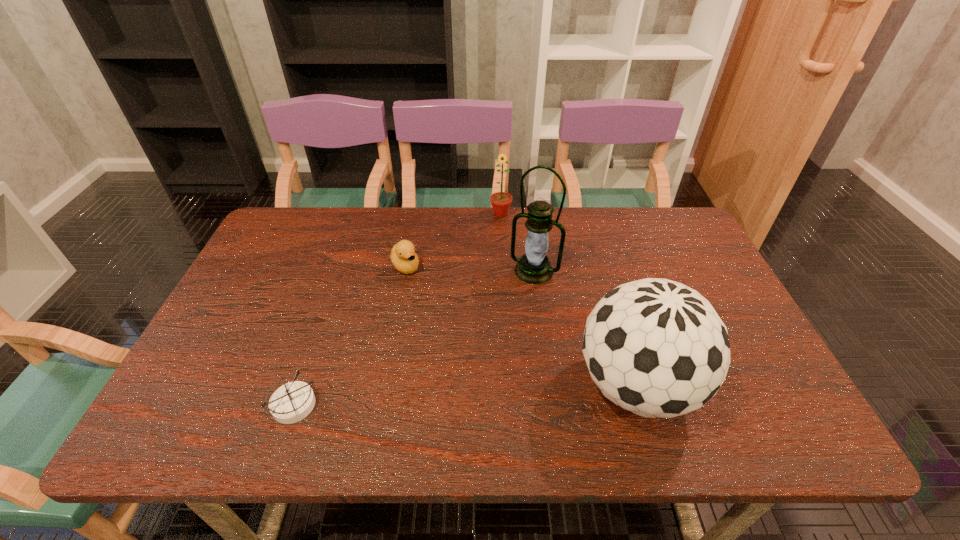
What are the coordinates of `free spot located 0.350m on the face of the farthest object` in the screenshot? It's located at (471, 293).

Find the location of `vacant space located on the face of the farthest object`. vacant space located on the face of the farthest object is located at coordinates (485, 256).

Locate an element on the screen. This screenshot has width=960, height=540. free space located on the face of the farthest object is located at coordinates (486, 254).

What are the coordinates of `vacant space positioned 0.200m facing forward on the fourth tallest object` in the screenshot? It's located at (446, 322).

You are a GUI agent. You are given a task and a screenshot of the screen. Output one action in this format:
    pyautogui.click(x=<x>, y=<y>)
    Task: Click on the free space located facing forward on the fourth tallest object
    
    Given the screenshot: What is the action you would take?
    pyautogui.click(x=487, y=374)

Identify the location of free spot located 0.280m facing forward on the fourth tallest object. This screenshot has height=540, width=960. (463, 342).

What are the coordinates of `blank area located on the side where the lantern emits light` in the screenshot? It's located at (489, 348).

Image resolution: width=960 pixels, height=540 pixels. Identify the location of vacant space located on the side where the lantern emits light. (463, 393).

The height and width of the screenshot is (540, 960). In order to click on vacant point located 0.100m on the side where the lantern emits light in this screenshot , I will do `click(512, 307)`.

I want to click on object that is at the far edge, so click(501, 201).